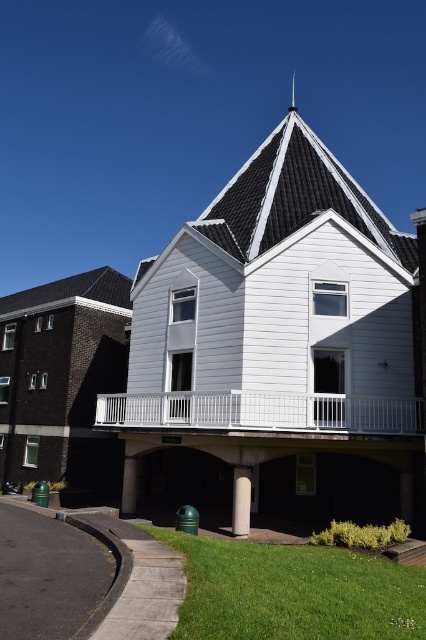
In the scene shown: You are a window cleaner who needs to reach both the green matte pillar at lower center and the shiny silver spire at upper center. Which object will require you to climb higher to reach?

The shiny silver spire at upper center requires climbing higher because it is taller than the green matte pillar at lower center.